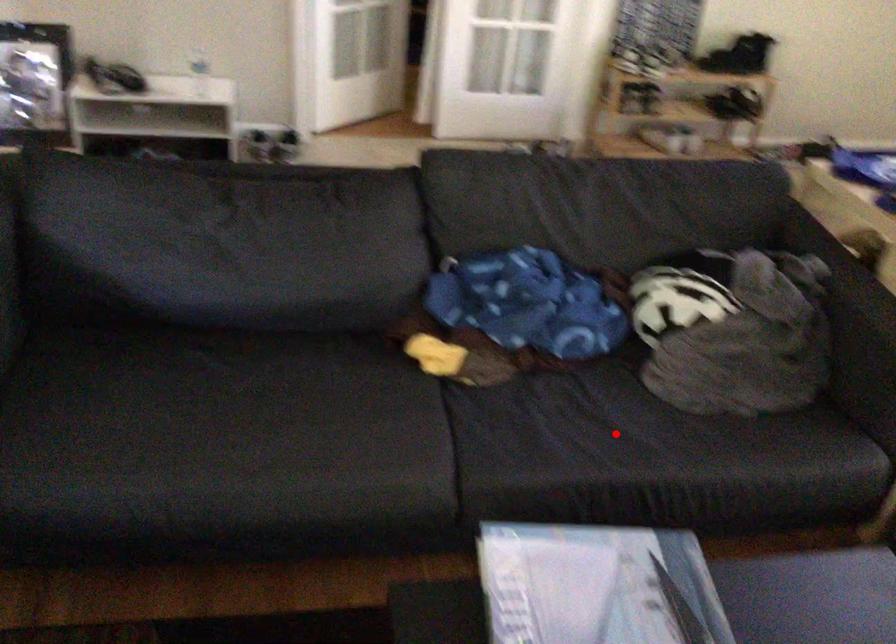
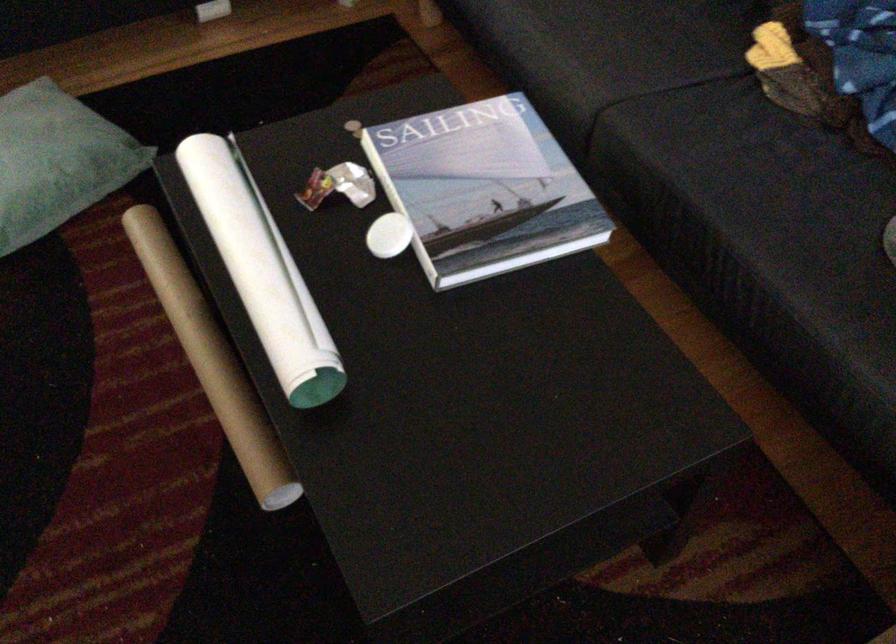
Where in the second image is the point corresponding to the highlighted location from the first image?

(778, 199)